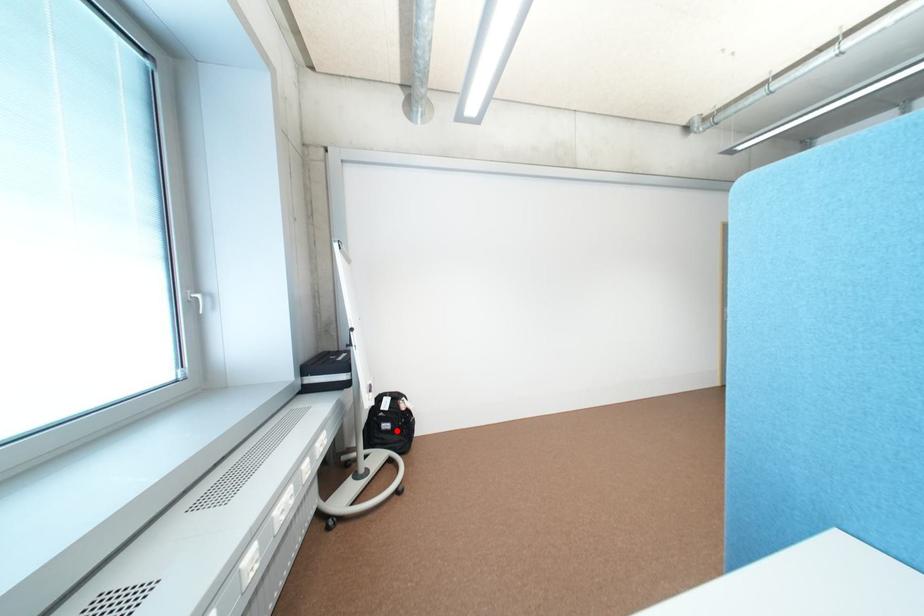
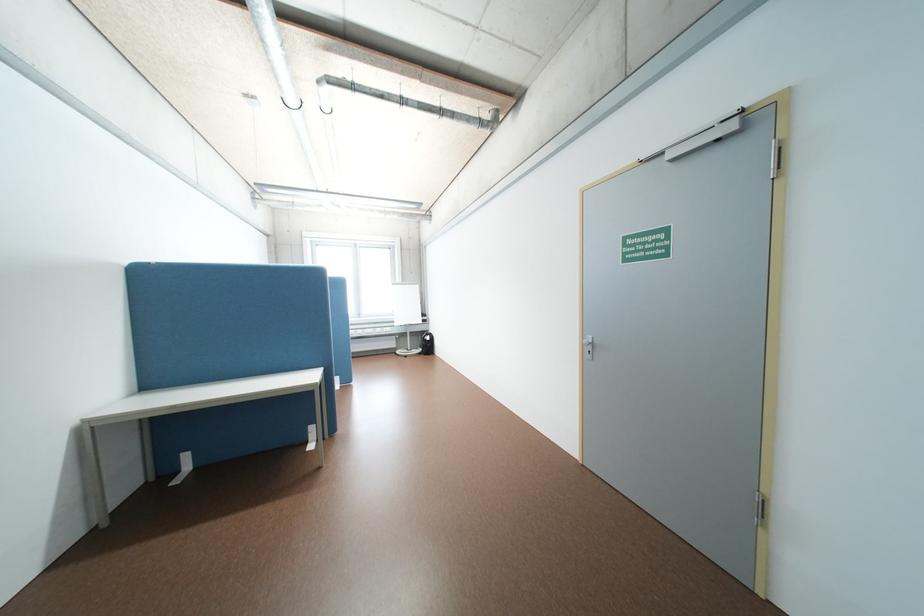
Question: I am providing you with two images of the same scene from different viewpoints. A red point is marked on the first image. Is the red point's position out of view in image 2?

Choices:
 (A) Yes
 (B) No

Answer: (A)